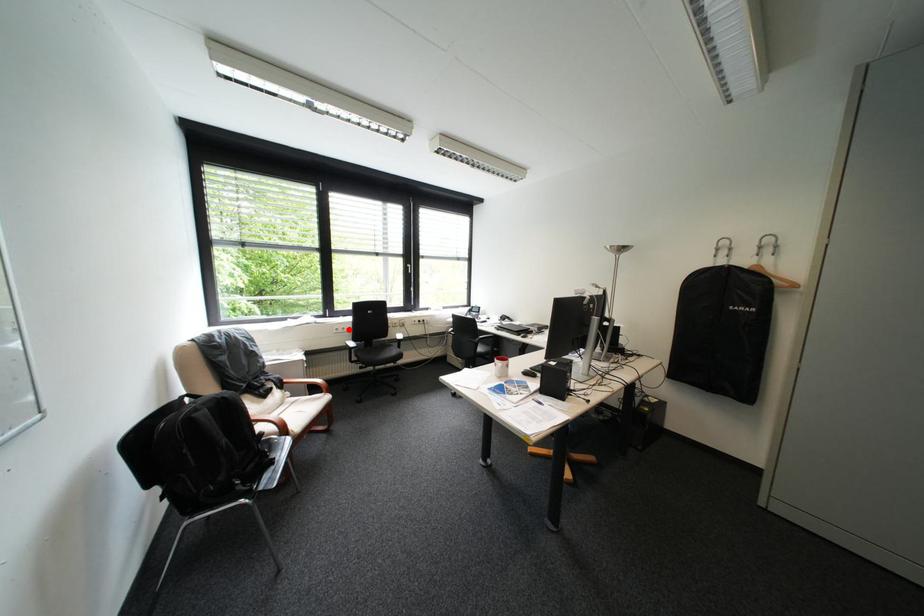
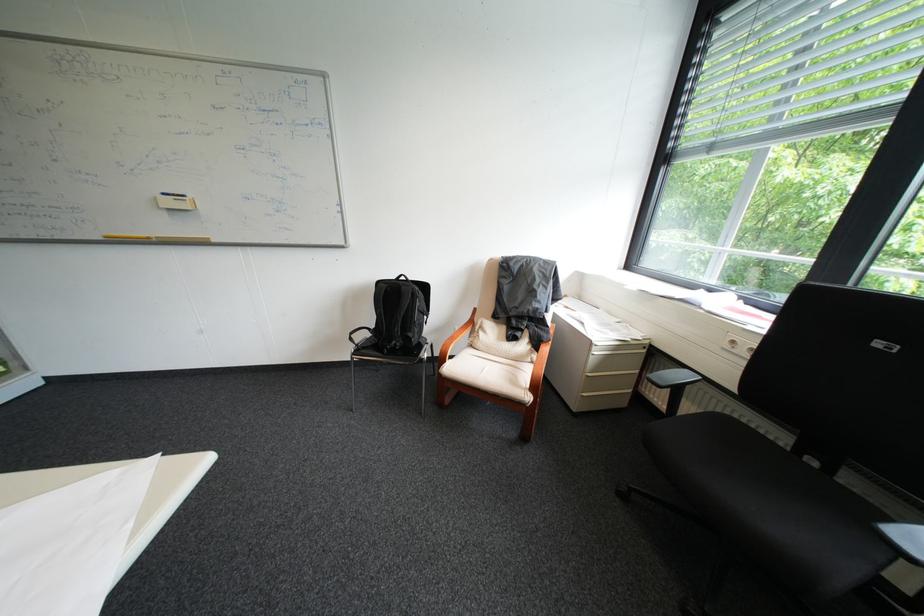
Locate, in the second image, the point that corresponds to the highlighted location in the first image.

(746, 342)